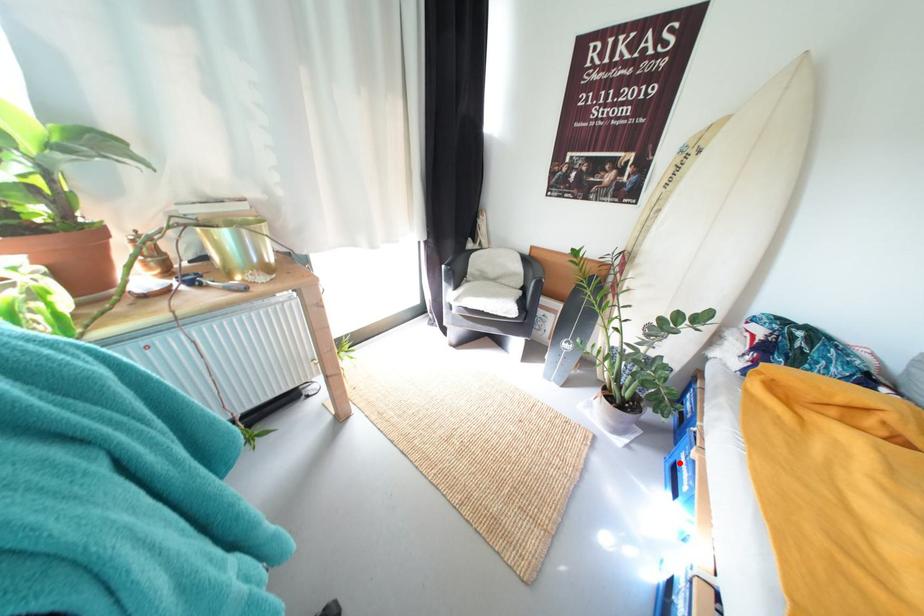
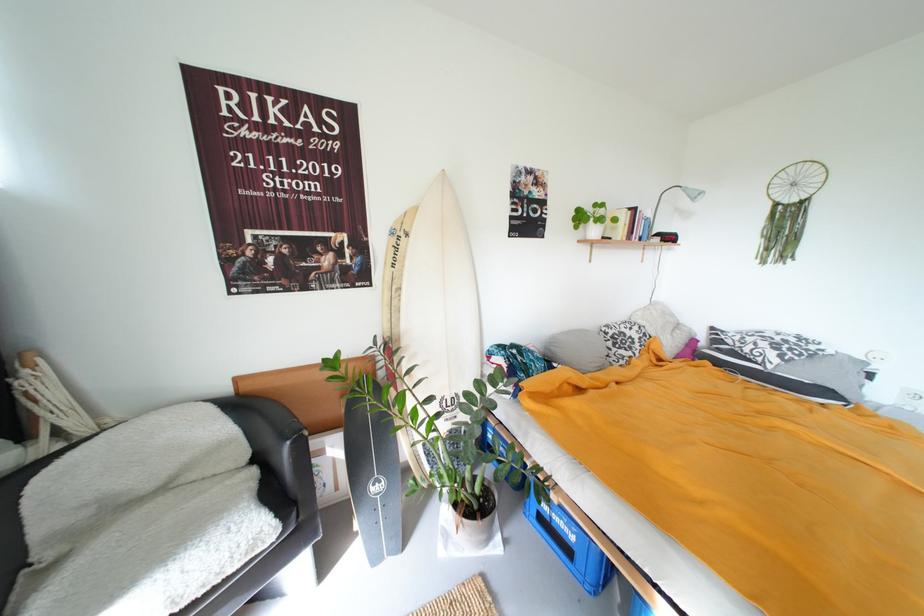
Question: I am providing you with two images of the same scene from different viewpoints. Given a red point in image1, look at the same physical point in image2. Is it:

Choices:
 (A) Closer to the viewpoint
 (B) Farther from the viewpoint

Answer: (B)